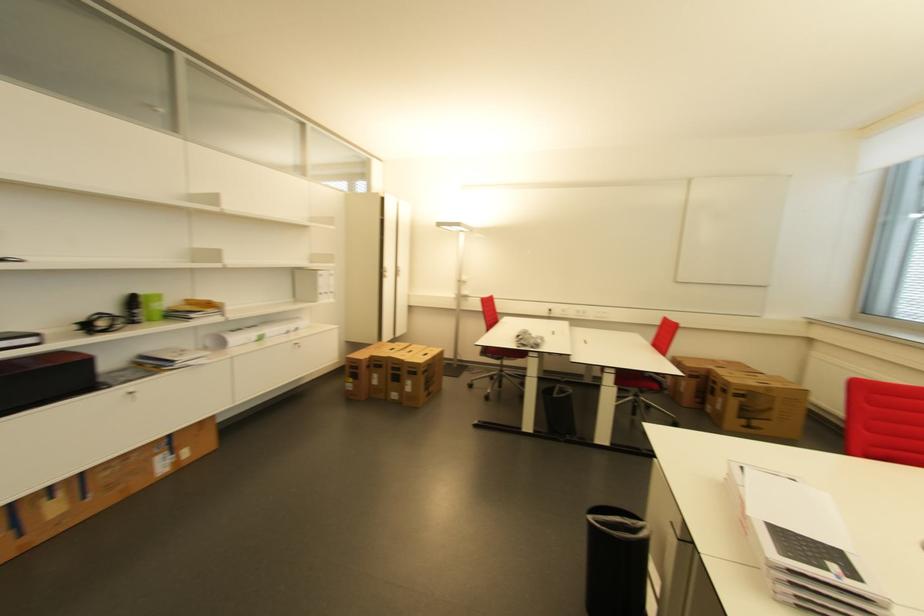
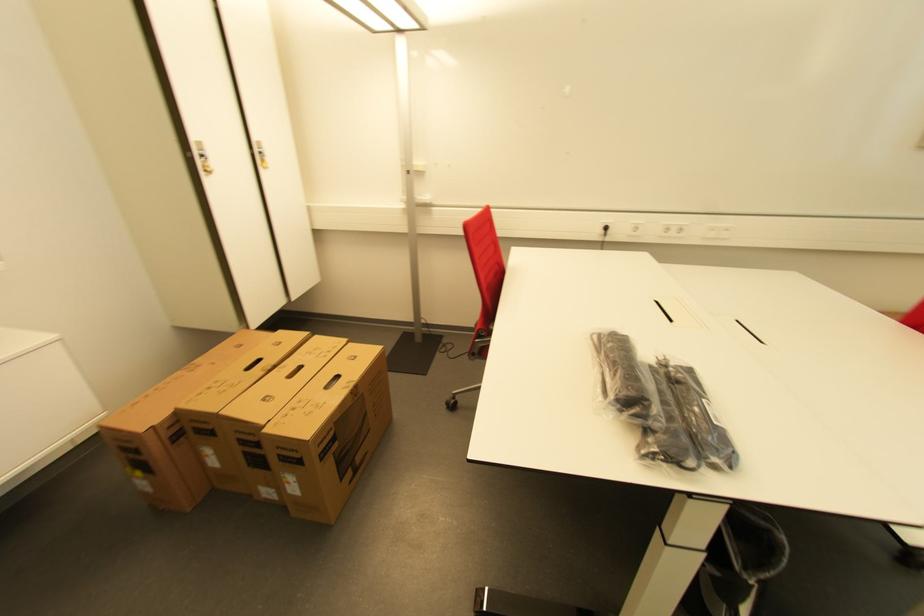
Question: In a continuous first-person perspective shot, in which direction is the camera moving?

Choices:
 (A) Left
 (B) Right
 (C) Forward
 (D) Backward

Answer: (C)